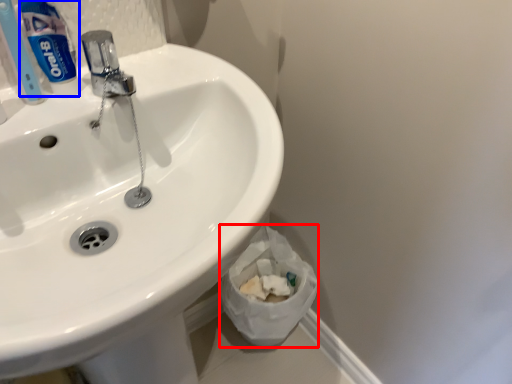
Question: Among these objects, which one is farthest to the camera, toilet paper (highlighted by a red box) or toothpaste (highlighted by a blue box)?

Choices:
 (A) toilet paper
 (B) toothpaste

Answer: (A)